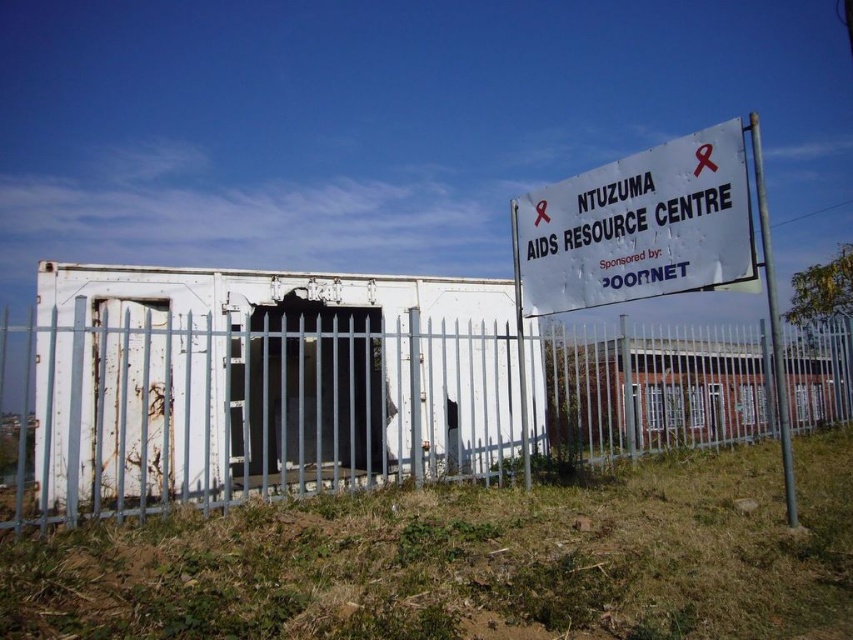
You are a visitor approaching the rusty metal fence at center and the white paper sign at upper right. Which object will you encounter first as you move towards the resource center?

The rusty metal fence at center is closer to you than the white paper sign at upper right, so you will encounter the rusty metal fence at center first.

You are standing in front of the white shipping container resource center and notice two points marked on the image. The first point is at coordinates point (556, 305) and the second is at point (141, 362). Which of these points appears closer to you?

Point (556, 305) is closer to the camera than point (141, 362), so the first point appears closer to you.

You are a delivery person trying to deliver a package to the NTUZUMA AIDS RESOURCE CENTRE. You notice the rusty metal fence at center and the white paper sign at upper right. Which object is taller?

The rusty metal fence at center is much taller than the white paper sign at upper right.